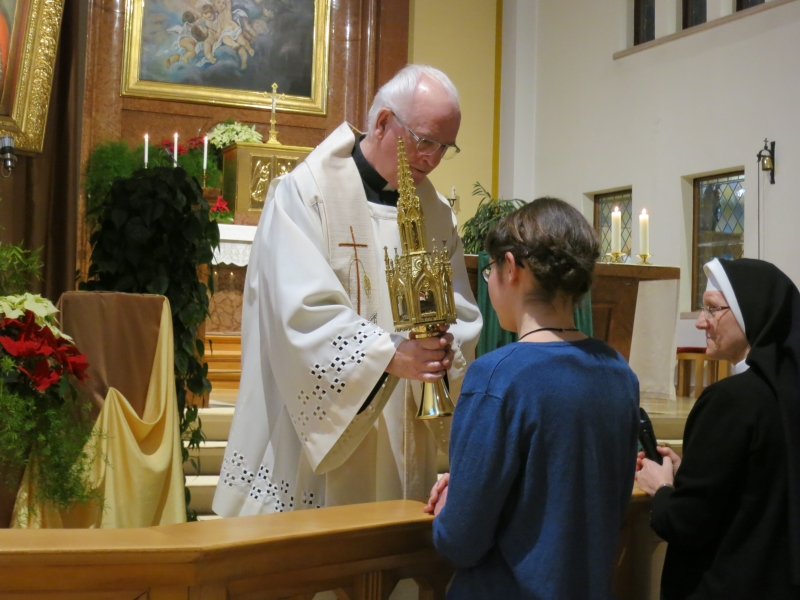
Find the location of a particular element. robes is located at coordinates (310, 271), (752, 497).